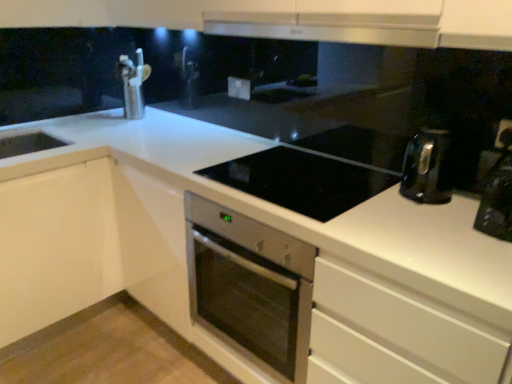
Question: Considering the positions of brushed metal faucet at upper left and white plastic electric outlet at upper center, the 2th electric outlet when ordered from back to front, in the image, is brushed metal faucet at upper left bigger or smaller than white plastic electric outlet at upper center, the 2th electric outlet when ordered from back to front,?

Choices:
 (A) small
 (B) big

Answer: (B)

Question: Considering the positions of brushed metal faucet at upper left and white plastic electric outlet at upper center, the 2th electric outlet when ordered from back to front, in the image, is brushed metal faucet at upper left taller or shorter than white plastic electric outlet at upper center, the 2th electric outlet when ordered from back to front,?

Choices:
 (A) short
 (B) tall

Answer: (B)

Question: Which is farther from the white plastic electric outlet at center, the 2th electric outlet viewed from the front?

Choices:
 (A) stainless steel oven at center
 (B) black glossy coffee machine at right
 (C) brushed metal faucet at upper left
 (D) black glass cooktop at center
 (E) white plastic electric outlet at upper center, which is the second electric outlet from top to bottom

Answer: (B)

Question: Estimate the real-world distances between objects in this image. Which object is closer to the black glass cooktop at center?

Choices:
 (A) white plastic electric outlet at upper center, the 2th electric outlet when ordered from back to front
 (B) white plastic electric outlet at center, which is counted as the 2th electric outlet, starting from the bottom
 (C) black glossy coffee machine at right
 (D) stainless steel oven at center
 (E) satin silver exhaust hood at upper center

Answer: (D)